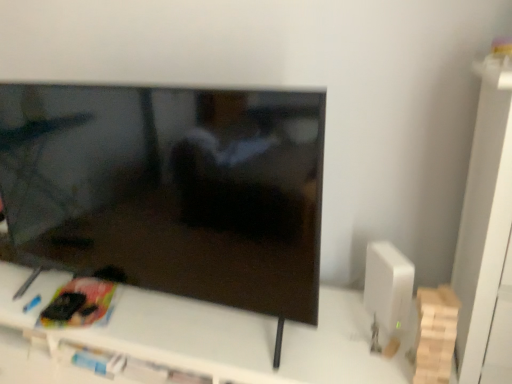
Question: Is point (498, 157) positioned closer to the camera than point (152, 345)?

Choices:
 (A) closer
 (B) farther

Answer: (A)

Question: Considering their positions, is white matte cabinet at right located in front of or behind white plastic tv stand at center?

Choices:
 (A) behind
 (B) front

Answer: (B)

Question: Considering the real-world distances, which object is farthest from the matte black tv at center?

Choices:
 (A) white matte cabinet at right
 (B) white plastic tv stand at center

Answer: (A)

Question: Based on their relative distances, which object is farther from the white matte cabinet at right?

Choices:
 (A) matte black tv at center
 (B) white plastic tv stand at center

Answer: (A)